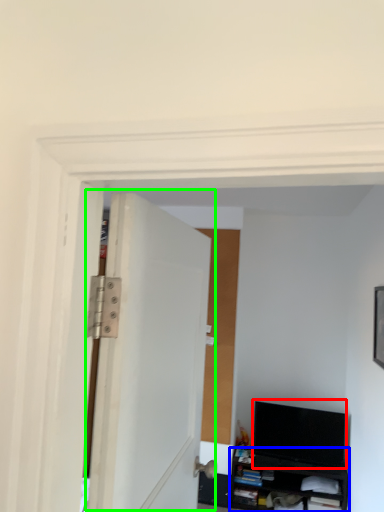
Question: Which is nearer to the computer monitor (highlighted by a red box)? cabinetry (highlighted by a blue box) or door (highlighted by a green box).

Choices:
 (A) cabinetry
 (B) door

Answer: (A)